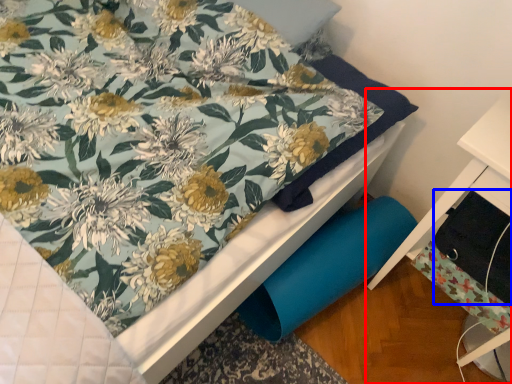
Question: Which object appears closest to the camera in this image, furniture (highlighted by a red box) or drawer (highlighted by a blue box)?

Choices:
 (A) furniture
 (B) drawer

Answer: (A)